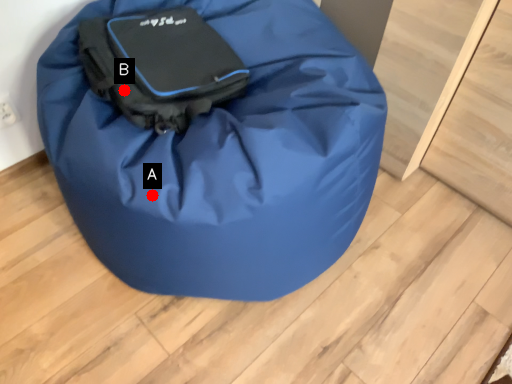
Question: Two points are circled on the image, labeled by A and B beside each circle. Which of the following is the closest to the observer?

Choices:
 (A) A is closer
 (B) B is closer

Answer: (A)